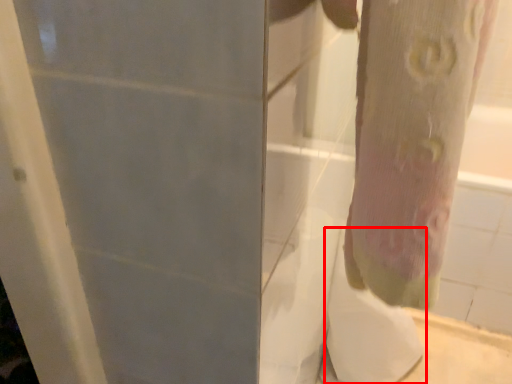
Question: From the image, what is the correct spatial relationship of toilet paper (annotated by the red box) in relation to tree trunk?

Choices:
 (A) right
 (B) left

Answer: (A)